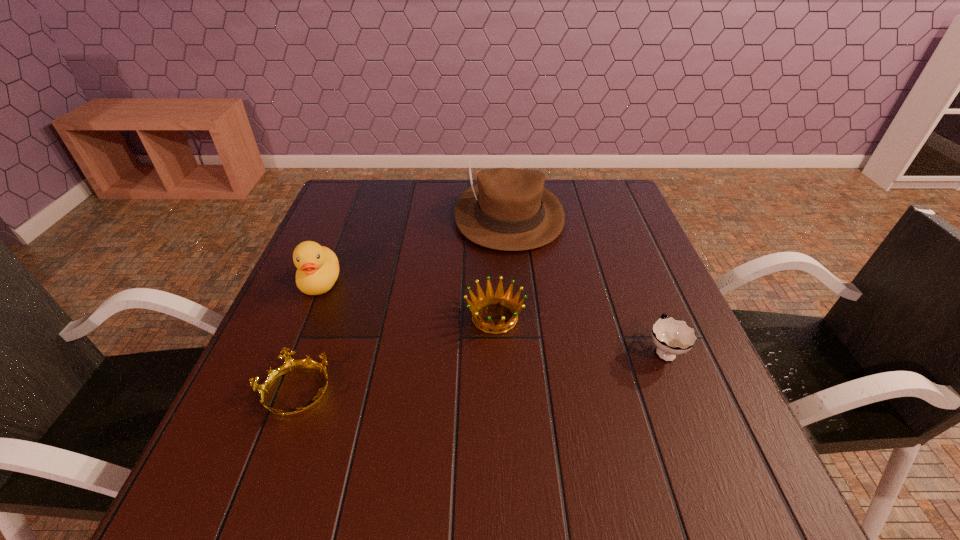
The image size is (960, 540). I want to click on blank space at the near edge, so click(x=627, y=524).

In order to click on vacant space at the left edge in this screenshot , I will do `click(238, 442)`.

Locate an element on the screen. The height and width of the screenshot is (540, 960). free space at the right edge is located at coordinates (633, 244).

In the image, there is a desktop. Where is `free space at the far left corner`? free space at the far left corner is located at coordinates (370, 180).

Where is `vacant space at the near left corner`? vacant space at the near left corner is located at coordinates (287, 519).

The height and width of the screenshot is (540, 960). I want to click on free space at the far right corner of the desktop, so click(617, 181).

Find the location of a particular element. The image size is (960, 540). blank region between the shorter crown and the farther crown is located at coordinates (396, 355).

Identify the location of vacant space in between the right crown and the duck. (408, 300).

Where is `free space between the nearer crown and the cup`? This screenshot has height=540, width=960. free space between the nearer crown and the cup is located at coordinates [480, 372].

You are a GUI agent. You are given a task and a screenshot of the screen. Output one action in this format:
    pyautogui.click(x=<x>, y=<y>)
    Task: Click on the free space between the duck and the shortest object
    Image resolution: width=960 pixels, height=540 pixels.
    Given the screenshot: What is the action you would take?
    click(308, 338)